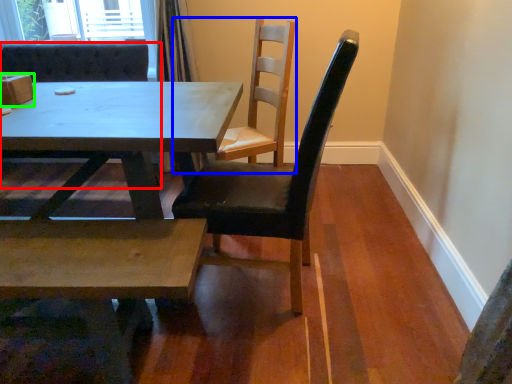
Question: Which is farther away from chair (highlighted by a red box)? chair (highlighted by a blue box) or box (highlighted by a green box)?

Choices:
 (A) chair
 (B) box

Answer: (A)